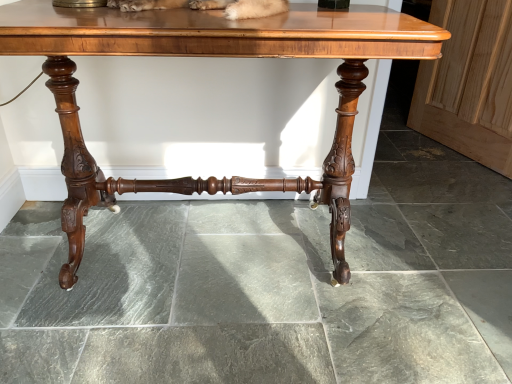
Question: Considering the positions of wooden screen door at right and polished wood table at center in the image, is wooden screen door at right wider or thinner than polished wood table at center?

Choices:
 (A) thin
 (B) wide

Answer: (A)

Question: Considering the positions of wooden screen door at right and polished wood table at center in the image, is wooden screen door at right taller or shorter than polished wood table at center?

Choices:
 (A) short
 (B) tall

Answer: (A)

Question: Considering the positions of point pyautogui.click(x=422, y=66) and point pyautogui.click(x=45, y=51), is point pyautogui.click(x=422, y=66) closer or farther from the camera than point pyautogui.click(x=45, y=51)?

Choices:
 (A) closer
 (B) farther

Answer: (B)

Question: From a real-world perspective, is polished wood table at center above or below wooden screen door at right?

Choices:
 (A) below
 (B) above

Answer: (B)

Question: Is polished wood table at center spatially inside wooden screen door at right, or outside of it?

Choices:
 (A) outside
 (B) inside

Answer: (A)

Question: Looking at their shapes, would you say polished wood table at center is wider or thinner than wooden screen door at right?

Choices:
 (A) wide
 (B) thin

Answer: (A)

Question: From the image's perspective, is polished wood table at center above or below wooden screen door at right?

Choices:
 (A) below
 (B) above

Answer: (A)